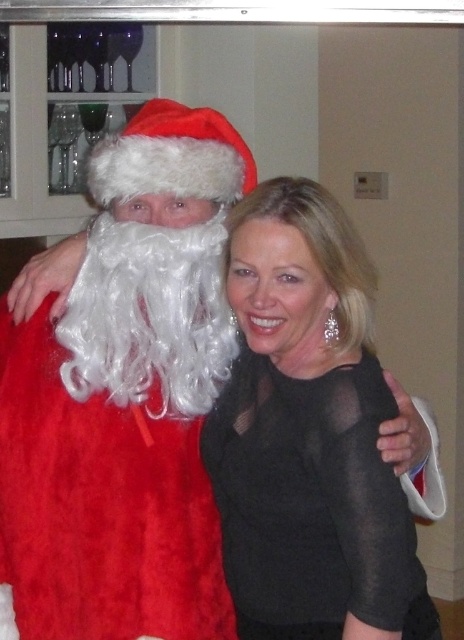
From the picture: You are planning to take a photo of the fuzzy red santa at left and the black sheer dress at center. Which one is more to the left in the image?

The fuzzy red santa at left is more to the left than the black sheer dress at center.

You are standing in the room and want to move from point A to point B. Point A is at coordinates point (343, 576) and point B is at coordinates point (131, 163). Which direction should you move to get from point A to point B?

To move from point A at coordinates point (343, 576) to point B at coordinates point (131, 163), you should move diagonally towards the lower left direction since point A is in front of point B.